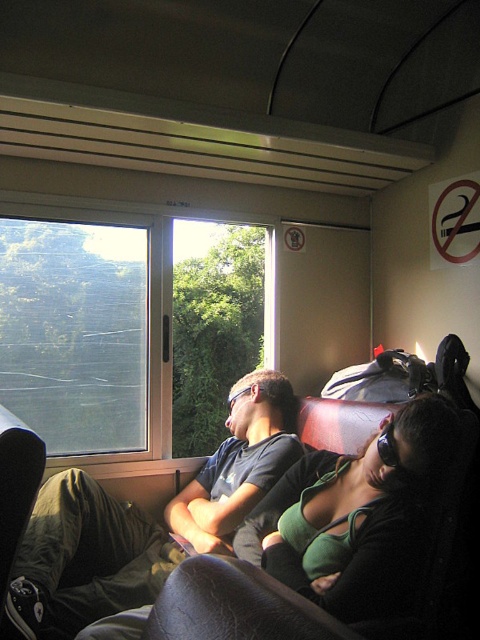
You are standing in the train carriage and want to take a photo of the point at coordinate point (55,440). Your camera has a minimum focus distance of 8 feet. Will the camera be able to focus on the point?

The point at coordinate point (55,440) is 7.91 feet away from the camera, which is within the camera minimum focus distance of 8 feet. Therefore, the camera can focus on the point.